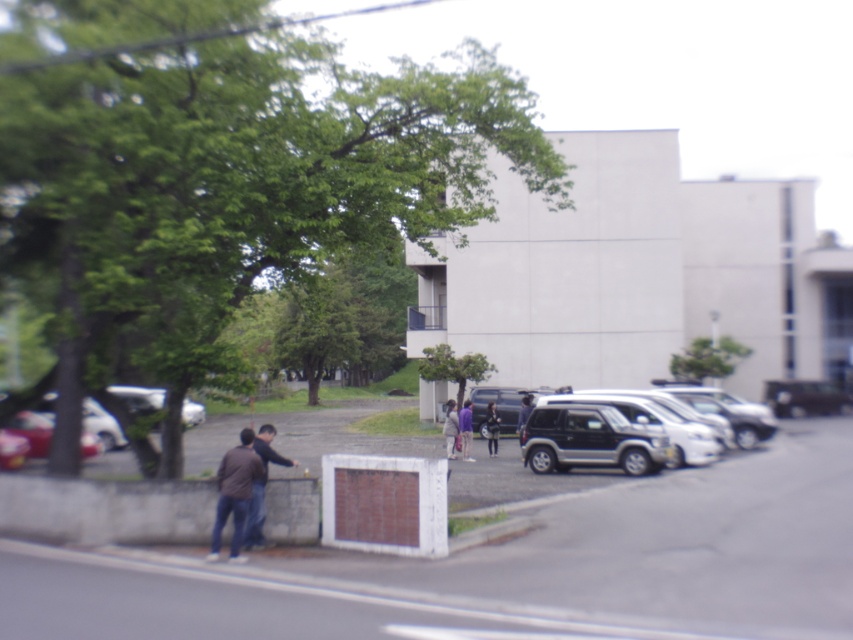
In the scene shown: You are standing at the point with coordinates point (560,449) and want to walk towards the point (248,449). Which direction should you move in to get there?

You should move downward because point (560,449) is further to the viewer than point (248,449), so moving downward will take you towards it.

You are standing at the edge of the paved road with white lane markings. You need to walk to the purple fabric person at center. Will you pass by the satin silver suv at right on your way?

Yes, you will pass by the satin silver suv at right on your way to the purple fabric person at center because the satin silver suv at right is closer to you than the purple fabric person at center.

You are standing on the paved road with white lane markings and see a silver metallic car at left and dark blue jeans at center. Which object is located to the right of the other?

The silver metallic car at left is positioned on the left side of dark blue jeans at center, so the dark blue jeans at center is to the right of the silver metallic car at left.